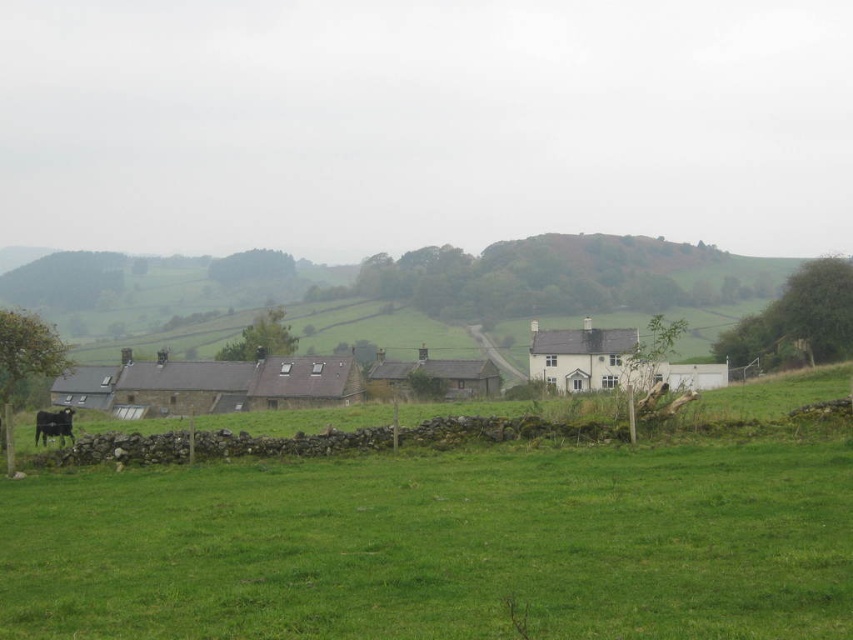
Does green grass at center have a lesser height compared to black fur at lower left?

Indeed, green grass at center has a lesser height compared to black fur at lower left.

Who is more forward, (138, 582) or (44, 410)?

Point (138, 582) is more forward.

This screenshot has width=853, height=640. I want to click on green grass at center, so click(x=440, y=545).